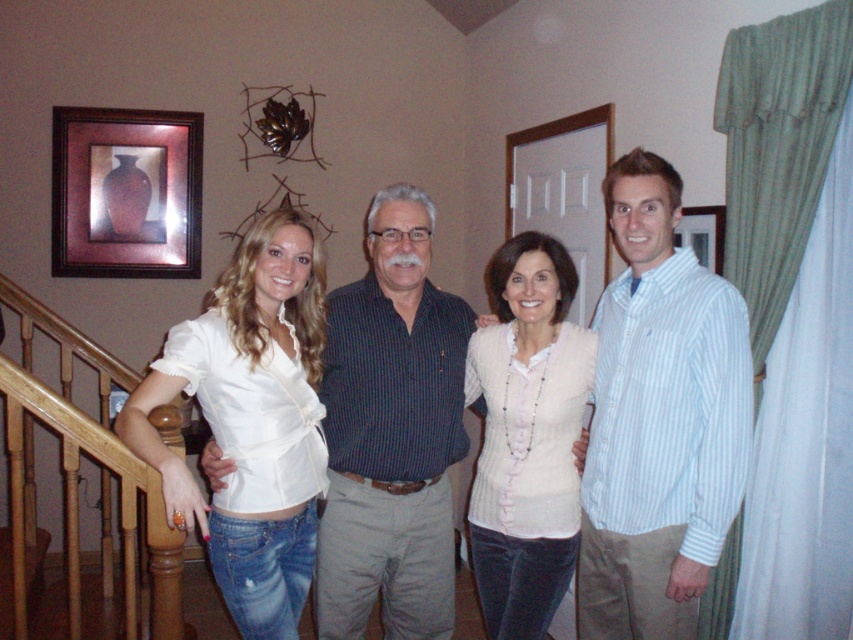
Question: Can you confirm if light blue striped shirt at right is positioned above white fabric shirt at right?

Choices:
 (A) yes
 (B) no

Answer: (B)

Question: Can you confirm if dark blue striped shirt at center is positioned above brown wooden picture frame at upper left?

Choices:
 (A) no
 (B) yes

Answer: (A)

Question: Which object is farther from the camera taking this photo?

Choices:
 (A) white satin blouse at left
 (B) white fabric shirt at right

Answer: (B)

Question: Which is farther from the brown wooden picture frame at upper left?

Choices:
 (A) white fabric shirt at right
 (B) dark blue striped shirt at center

Answer: (A)

Question: Where is dark blue striped shirt at center located in relation to pink textured sweater at center in the image?

Choices:
 (A) left
 (B) right

Answer: (A)

Question: Which point is closer to the camera?

Choices:
 (A) (236, 317)
 (B) (685, 241)
 (C) (735, 397)
 (D) (372, 202)

Answer: (C)